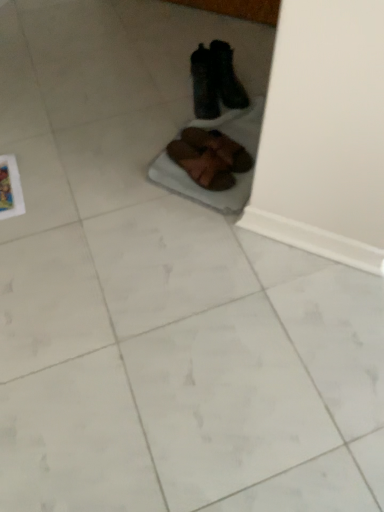
Find the location of a particular element. This screenshot has width=384, height=512. vacant space behind black leather boots at upper center, which ranks as the fourth footwear in bottom-to-top order is located at coordinates (235, 64).